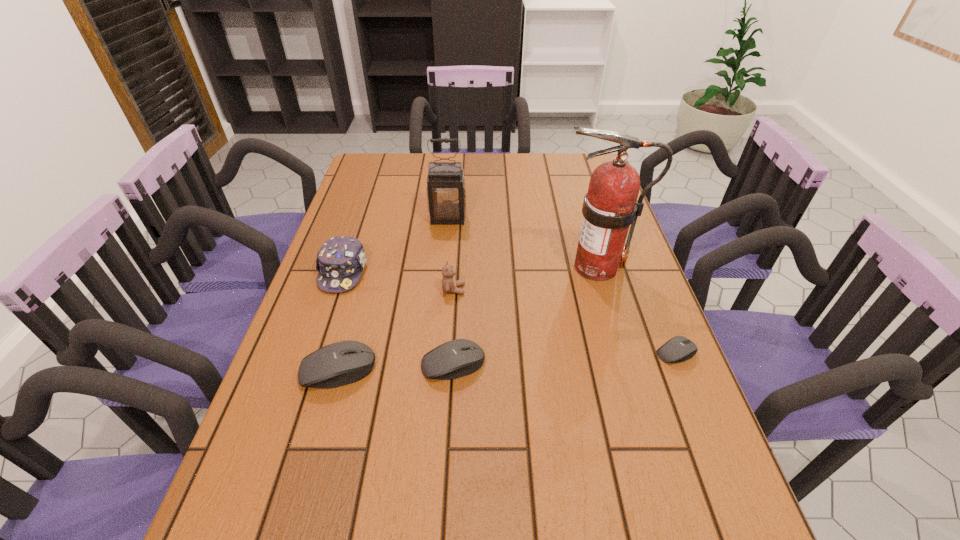
Locate an element on the screen. The image size is (960, 540). the fourth closest object to the rightmost computer equipment is located at coordinates point(446,189).

Identify the location of object that is the third closest to the teddy bear. (340, 261).

Identify which computer equipment is the closest to the headwear. Please provide its 2D coordinates. Your answer should be formatted as a tuple, i.e. [(x, y)], where the tuple contains the x and y coordinates of a point satisfying the conditions above.

[(344, 362)]

The image size is (960, 540). I want to click on computer equipment that stands as the second closest to the headwear, so click(x=460, y=357).

The height and width of the screenshot is (540, 960). I want to click on free space that satisfies the following two spatial constraints: 1. at the nozzle of the fire extinguisher; 2. on the right side of the shortest computer equipment, so click(x=621, y=353).

Where is `vacant area that satisfies the following two spatial constraints: 1. on the front-facing side of the teddy bear; 2. on the back side of the shortest object`? The height and width of the screenshot is (540, 960). vacant area that satisfies the following two spatial constraints: 1. on the front-facing side of the teddy bear; 2. on the back side of the shortest object is located at coordinates (449, 353).

The image size is (960, 540). In order to click on free spot that satisfies the following two spatial constraints: 1. on the front-facing side of the rightmost computer equipment; 2. on the left side of the lantern in this screenshot , I will do `click(436, 353)`.

Where is `free space that satisfies the following two spatial constraints: 1. on the front-facing side of the shortest object; 2. on the left side of the teddy bear`? The image size is (960, 540). free space that satisfies the following two spatial constraints: 1. on the front-facing side of the shortest object; 2. on the left side of the teddy bear is located at coordinates (449, 353).